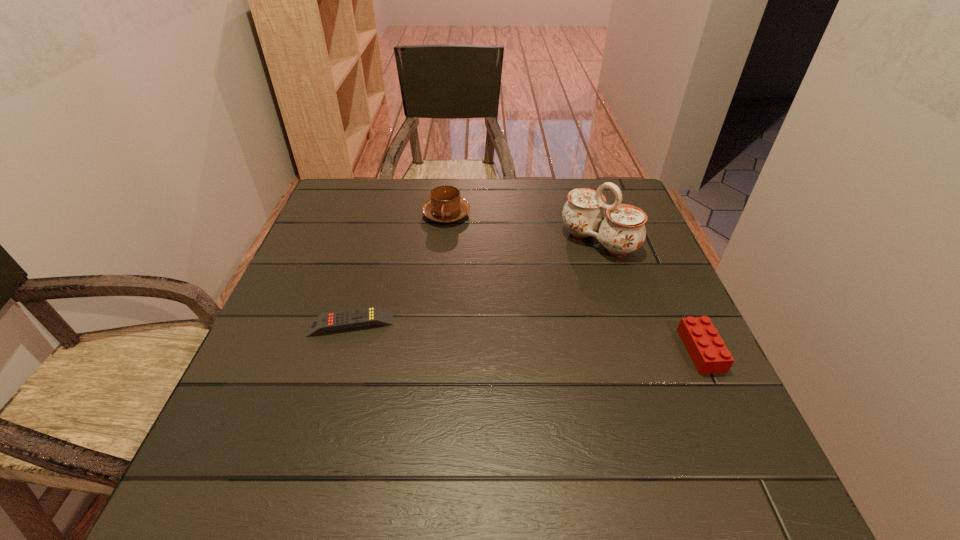
You are a GUI agent. You are given a task and a screenshot of the screen. Output one action in this format:
    pyautogui.click(x=<x>, y=<y>)
    Task: Click on the shortest object
    The height and width of the screenshot is (540, 960).
    Given the screenshot: What is the action you would take?
    pyautogui.click(x=331, y=321)

Identify the location of remote control. (331, 321).

Identify the location of Lego. The height and width of the screenshot is (540, 960). (709, 354).

Locate an element on the screen. the second shortest object is located at coordinates (709, 354).

Find the location of a particular element. The image size is (960, 540). cappuccino is located at coordinates (445, 206).

You are a GUI agent. You are given a task and a screenshot of the screen. Output one action in this format:
    pyautogui.click(x=<x>, y=<y>)
    Task: Click on the second tallest object
    The width and height of the screenshot is (960, 540).
    Given the screenshot: What is the action you would take?
    pyautogui.click(x=445, y=206)

This screenshot has width=960, height=540. In order to click on chinaware in this screenshot , I will do `click(622, 231)`.

Locate an element on the screen. The width and height of the screenshot is (960, 540). the tallest object is located at coordinates (622, 231).

At what (x,y) coordinates should I click in order to perform the action: click on vacant region located on the right of the remote control. Please return your answer as a coordinate pair (x, y). Looking at the image, I should click on (468, 323).

Where is `free space located on the back of the Lego`? This screenshot has width=960, height=540. free space located on the back of the Lego is located at coordinates (672, 290).